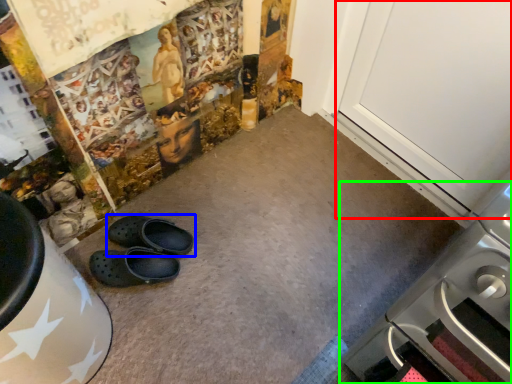
Question: Estimate the real-world distances between objects in this image. Which object is farther from door (highlighted by a red box), footwear (highlighted by a blue box) or home appliance (highlighted by a green box)?

Choices:
 (A) footwear
 (B) home appliance

Answer: (A)